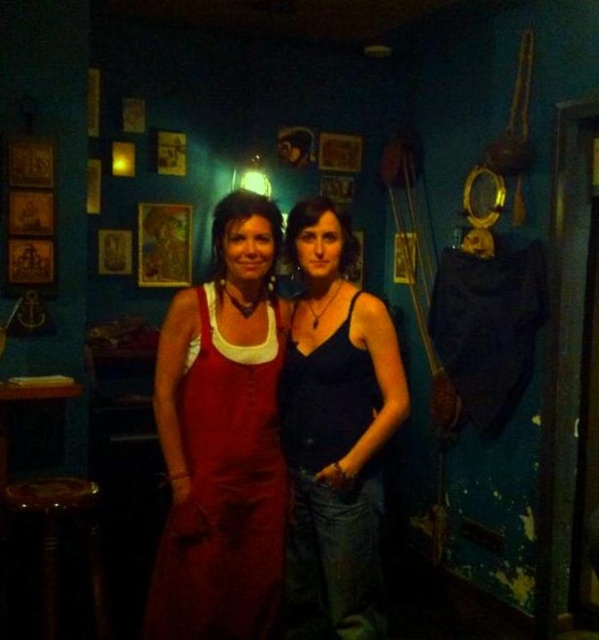
You are a photographer setting up a shoot in the room described. You need to determine if the matte red dress at center will fit on the wooden stool at lower left. Can you confirm if the dress is narrower than the stool?

The matte red dress at center is wider than the wooden stool at lower left, so it will not fit on the stool.

You are a delivery person who needs to place a small package between the matte blue tank top at center and the wooden stool at lower left. The package requires at least 1 meter of space. Can you fit it there?

The distance between the matte blue tank top at center and the wooden stool at lower left is 1.18 meters, which is more than the required 1 meter. Therefore, the package can be placed there.

You are a photographer setting up a shoot in a dimly lit room with deep blue walls. You have two subjects wearing a matte blue tank top at center and a matte red dress at center. The client wants to know which subject is positioned to the right of the other. Can you clarify?

The matte blue tank top at center is positioned on the right side of the matte red dress at center.